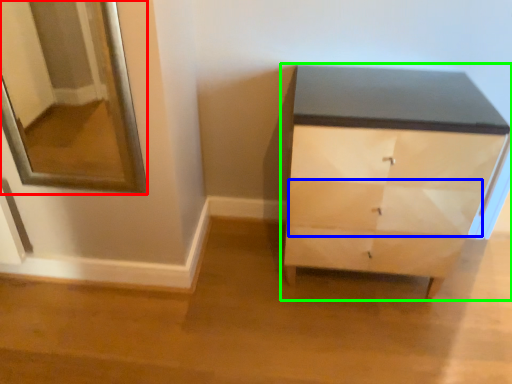
Question: Which is farther away from mirror (highlighted by a red box)? drawer (highlighted by a blue box) or chest of drawers (highlighted by a green box)?

Choices:
 (A) drawer
 (B) chest of drawers

Answer: (A)